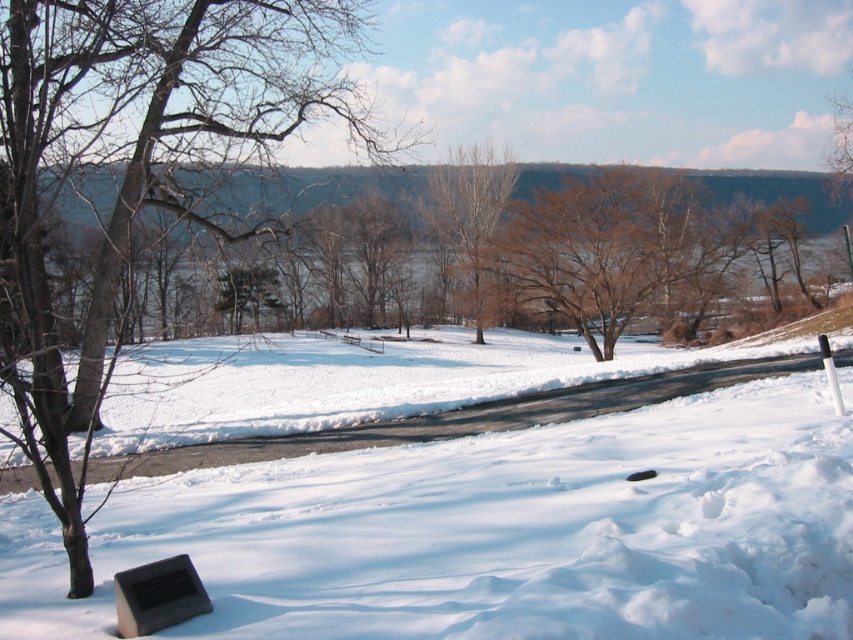
You are standing at the snow covered ground in the winter landscape. You see two points marked as point (695, 634) and point (21, 348). Which point is closer to you?

Point (695, 634) is closer to the viewer than point (21, 348).